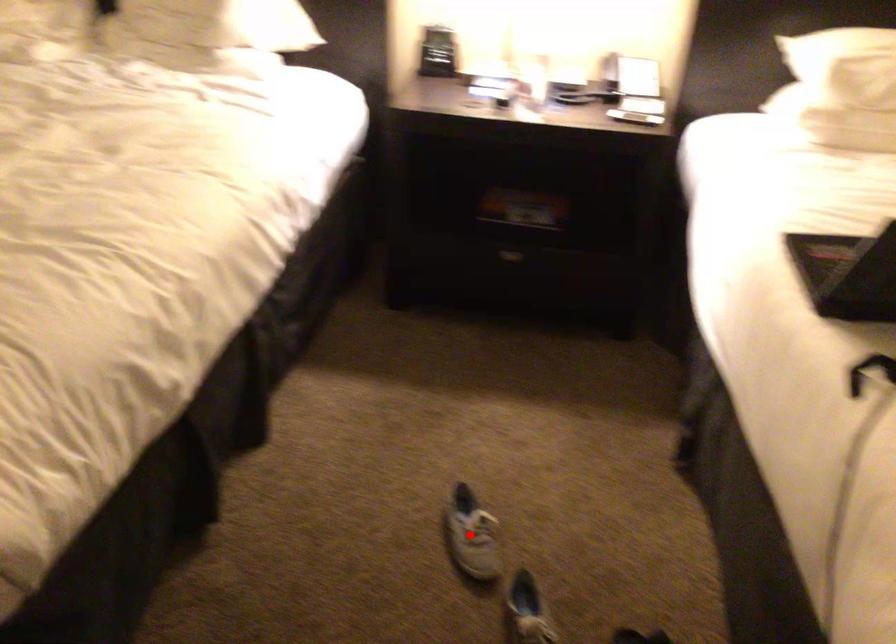
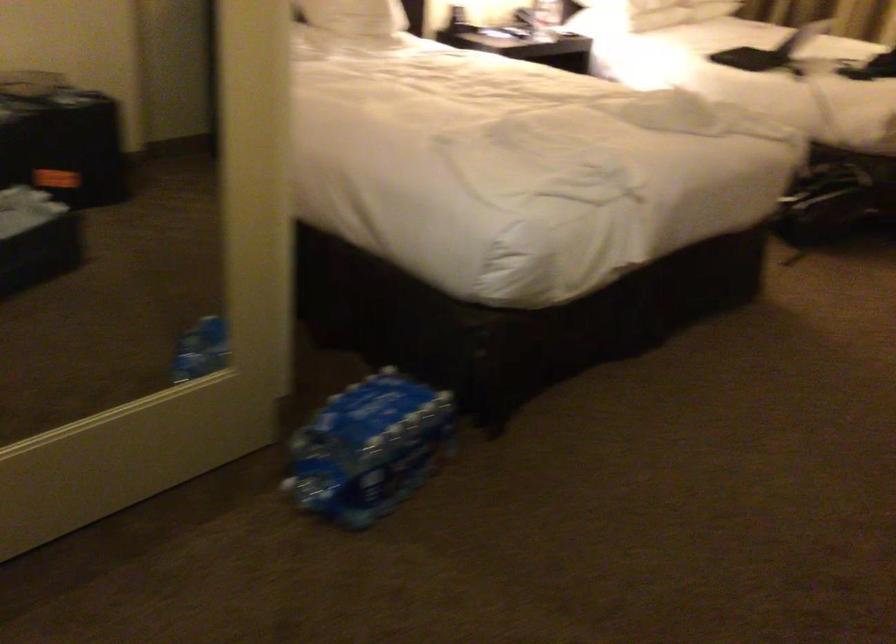
Question: I am providing you with two images of the same scene from different viewpoints. A red point is marked on the first image. Can you still see the location of the red point in image 2?

Choices:
 (A) Yes
 (B) No

Answer: (B)